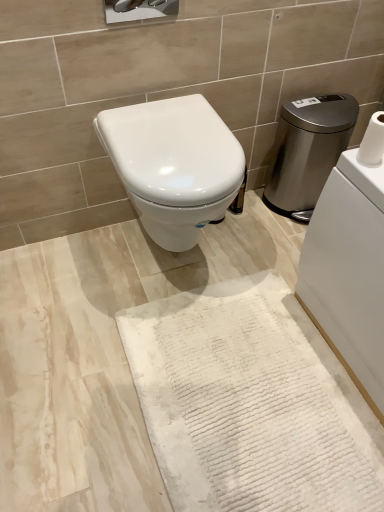
Question: Is the position of white textured bath mat at center less distant than that of stainless steel water heater at right?

Choices:
 (A) no
 (B) yes

Answer: (B)

Question: From a real-world perspective, is white textured bath mat at center under stainless steel water heater at right?

Choices:
 (A) no
 (B) yes

Answer: (B)

Question: Is there a large distance between white textured bath mat at center and stainless steel water heater at right?

Choices:
 (A) yes
 (B) no

Answer: (B)

Question: Considering the relative sizes of white textured bath mat at center and stainless steel water heater at right in the image provided, is white textured bath mat at center taller than stainless steel water heater at right?

Choices:
 (A) yes
 (B) no

Answer: (B)

Question: Could you tell me if white textured bath mat at center is facing stainless steel water heater at right?

Choices:
 (A) yes
 (B) no

Answer: (B)

Question: Does white textured bath mat at center have a smaller size compared to stainless steel water heater at right?

Choices:
 (A) no
 (B) yes

Answer: (B)

Question: Is stainless steel water heater at right oriented away from white glossy toilet at center?

Choices:
 (A) no
 (B) yes

Answer: (A)

Question: Is stainless steel water heater at right next to white glossy toilet at center and touching it?

Choices:
 (A) no
 (B) yes

Answer: (A)

Question: Can you confirm if stainless steel water heater at right is taller than white glossy toilet at center?

Choices:
 (A) yes
 (B) no

Answer: (A)

Question: Can you confirm if stainless steel water heater at right is positioned to the left of white glossy toilet at center?

Choices:
 (A) no
 (B) yes

Answer: (A)

Question: Is stainless steel water heater at right completely or partially outside of white glossy toilet at center?

Choices:
 (A) yes
 (B) no

Answer: (A)

Question: Can you confirm if stainless steel water heater at right is smaller than white glossy toilet at center?

Choices:
 (A) no
 (B) yes

Answer: (B)

Question: From the image's perspective, is white textured toilet paper at upper right on top of stainless steel water heater at right?

Choices:
 (A) no
 (B) yes

Answer: (A)